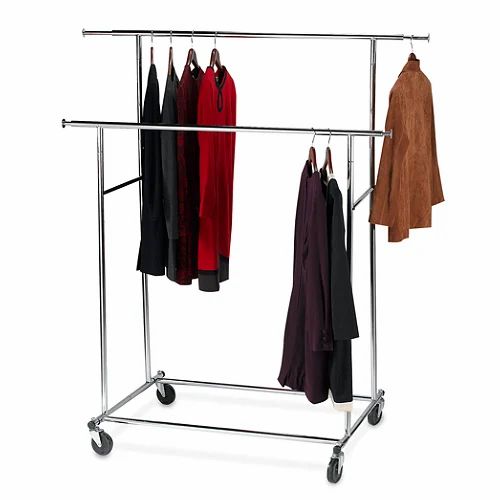
You are a GUI agent. You are given a task and a screenshot of the screen. Output one action in this format:
    pyautogui.click(x=<x>, y=<y>)
    Task: Click on the hangers
    This screenshot has width=500, height=500.
    Given the screenshot: What is the action you would take?
    pyautogui.click(x=408, y=58), pyautogui.click(x=327, y=162), pyautogui.click(x=313, y=159), pyautogui.click(x=212, y=60), pyautogui.click(x=193, y=58), pyautogui.click(x=172, y=61), pyautogui.click(x=156, y=59)